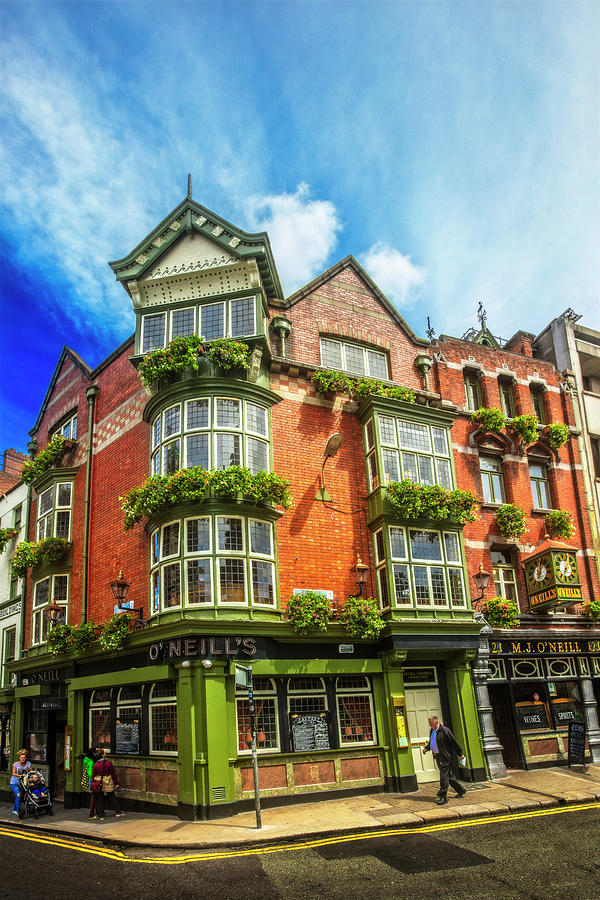
I want to click on clock, so click(x=562, y=571).